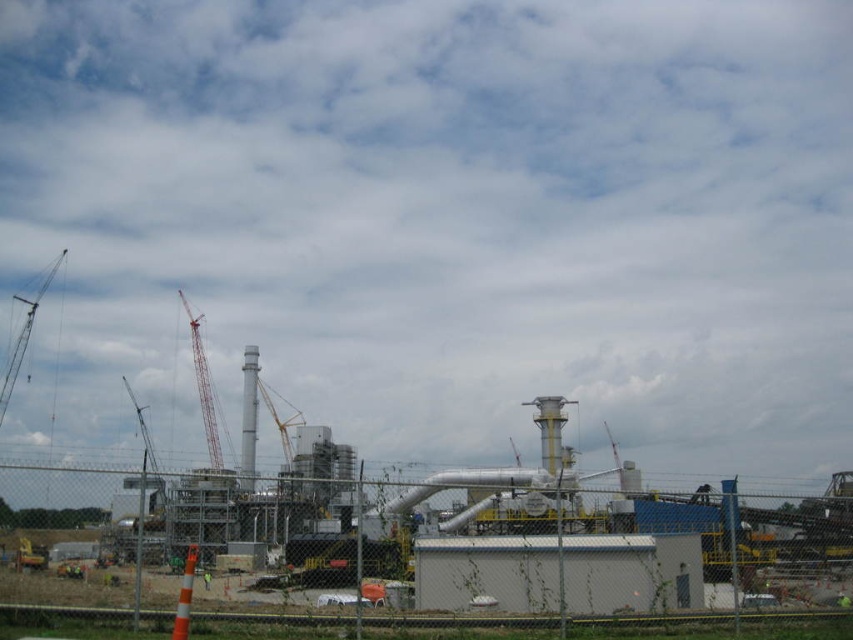
You are a safety inspector standing at the camera position. You need to inspect the metallic gray crane at left. Can you walk directly to it without crossing any obstacles? The path is clear except for a 100 feet wide fence.

The metallic gray crane at left is 68.56 feet away from camera, which is less than the 100 feet width of the fence. Therefore, you cannot walk directly to the crane without crossing the fence since the fence spans wider than the distance to the crane.

You are a construction worker who needs to transport a 10m wide container through the construction site. You see the white matte building at center and the metallic gray crane at upper left. Which object has enough width to allow the container to pass by without touching it?

The metallic gray crane at upper left has a greater width than the white matte building at center, so the container can pass by the metallic gray crane at upper left safely since its width is sufficient.

You are standing at the origin point in the construction site. Where is the red painted metal crane at center located?

The red painted metal crane at center is located at point (202, 387).